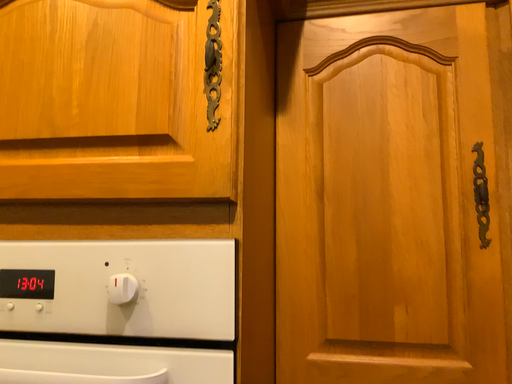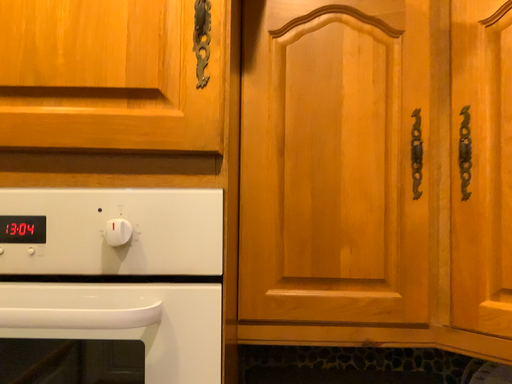
Question: Which way did the camera rotate in the video?

Choices:
 (A) rotated left
 (B) rotated right

Answer: (B)